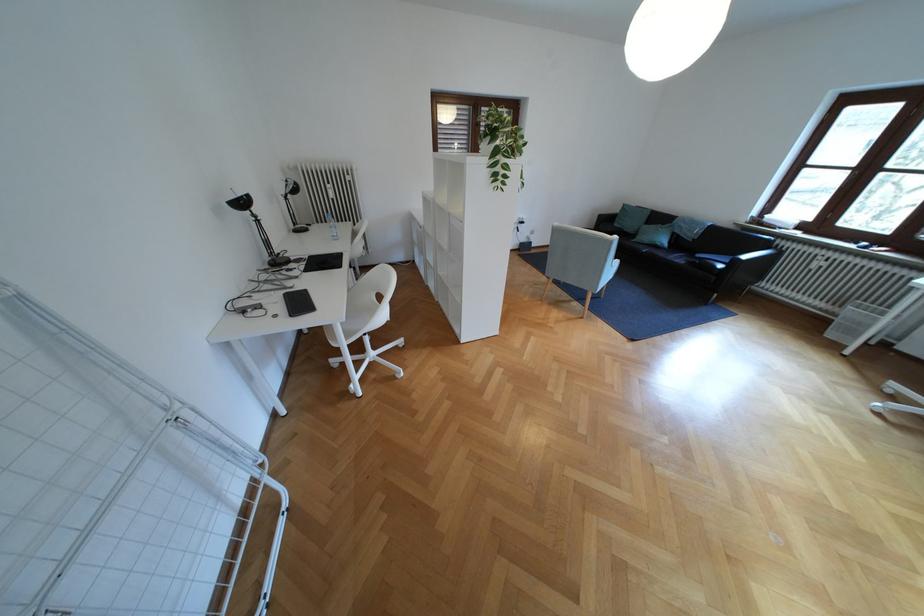
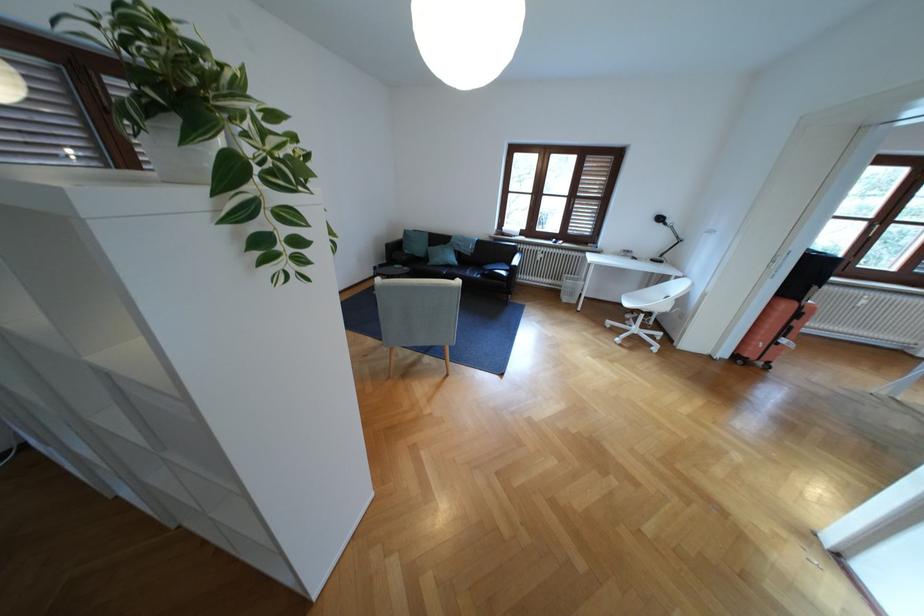
Locate, in the second image, the point that corresponds to point 496,148 in the first image.

(187, 155)